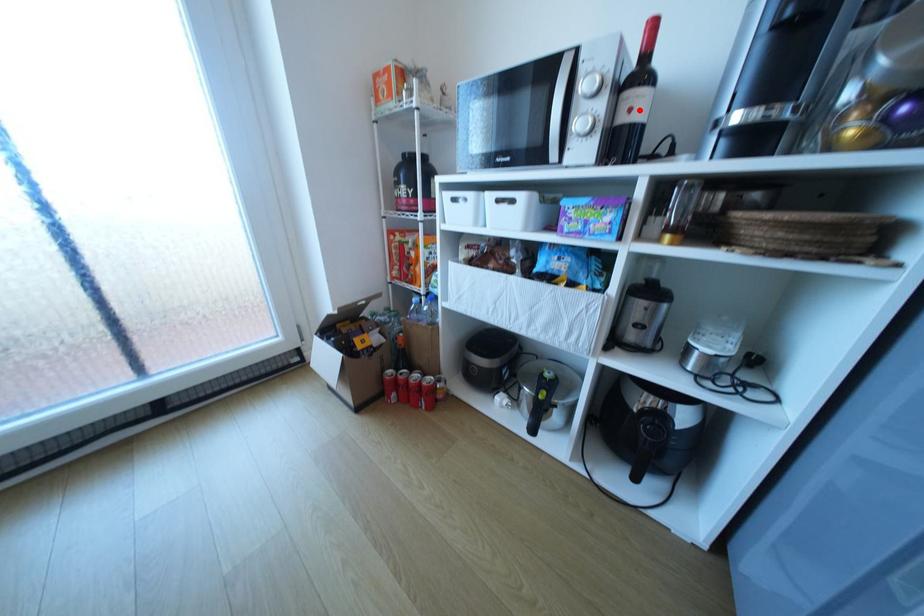
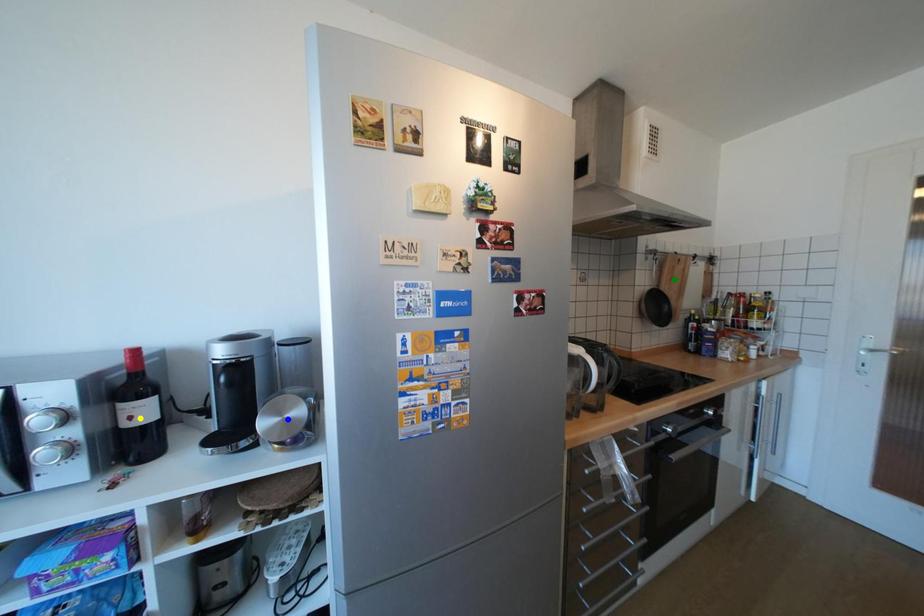
Question: I am providing you with two images of the same scene from different viewpoints. A red point is marked on the first image. You are given multiple points on the second image. Can you choose the point in image 2 that corresponds to the point in image 1?

Choices:
 (A) yellow point
 (B) green point
 (C) blue point

Answer: (A)